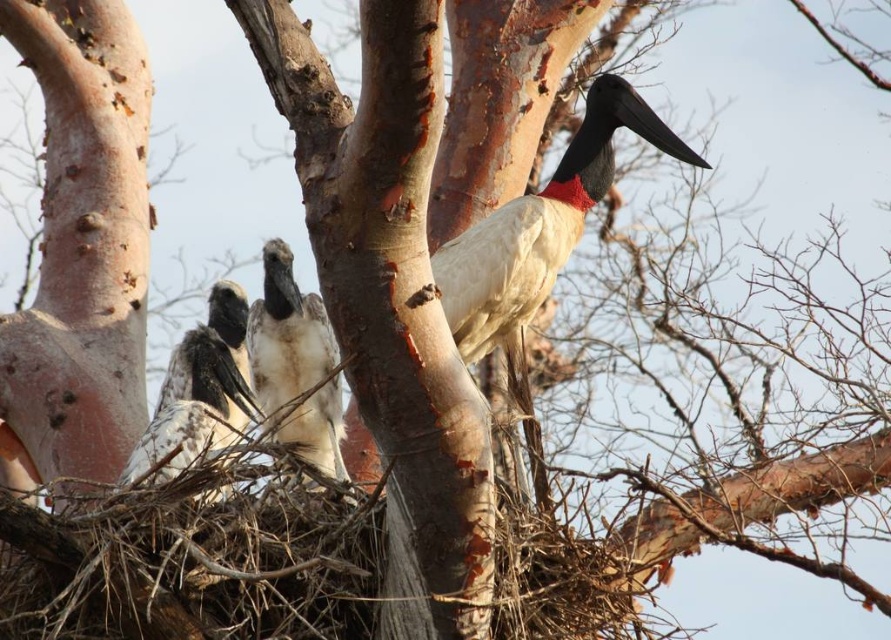
Does white feathered bird at center have a greater width compared to white feathered bird at left?

In fact, white feathered bird at center might be narrower than white feathered bird at left.

Which of these two, white feathered bird at center or white feathered bird at left, stands shorter?

With less height is white feathered bird at left.

The width and height of the screenshot is (891, 640). I want to click on white feathered bird at center, so click(295, 362).